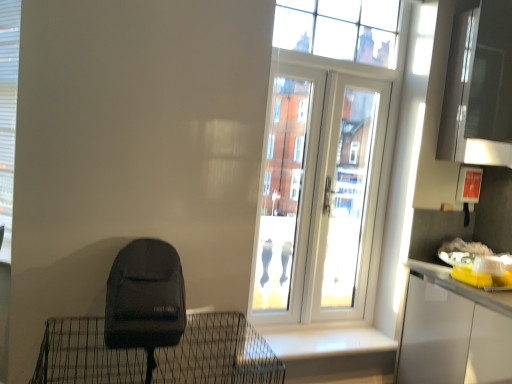
Question: From a real-world perspective, is white glossy window sill at lower center positioned above or below clear glass window at upper center?

Choices:
 (A) above
 (B) below

Answer: (B)

Question: Is white glossy window sill at lower center taller or shorter than clear glass window at upper center?

Choices:
 (A) tall
 (B) short

Answer: (B)

Question: Which object is the closest to the white plastic shutter at left?

Choices:
 (A) white glossy window sill at lower center
 (B) clear glass window at upper center
 (C) black matte backpack at lower left
 (D) white glossy door at upper center

Answer: (C)

Question: Which object is the farthest from the clear glass window at upper center?

Choices:
 (A) white plastic shutter at left
 (B) white glossy door at upper center
 (C) black matte backpack at lower left
 (D) white glossy window sill at lower center

Answer: (C)